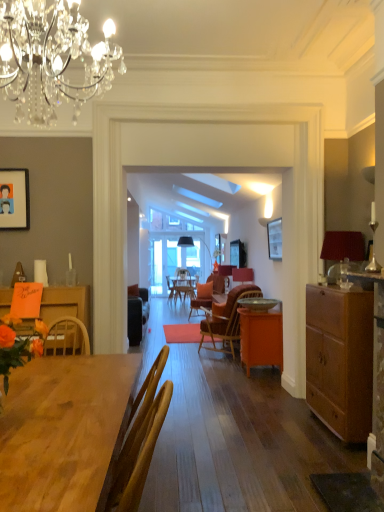
Question: Considering the relative sizes of crystal chandelier at upper center, the first lamp in the front-to-back sequence, and matte orange flowers at left in the image provided, is crystal chandelier at upper center, the first lamp in the front-to-back sequence, smaller than matte orange flowers at left?

Choices:
 (A) no
 (B) yes

Answer: (A)

Question: Is crystal chandelier at upper center, which is the 1th lamp from top to bottom, directly adjacent to matte orange flowers at left?

Choices:
 (A) no
 (B) yes

Answer: (A)

Question: Would you say crystal chandelier at upper center, the second lamp viewed from the back, is outside matte orange flowers at left?

Choices:
 (A) no
 (B) yes

Answer: (B)

Question: Can you confirm if crystal chandelier at upper center, positioned as the second lamp in bottom-to-top order, is wider than matte orange flowers at left?

Choices:
 (A) yes
 (B) no

Answer: (A)

Question: Can you confirm if crystal chandelier at upper center, the second lamp viewed from the back, is positioned to the right of matte orange flowers at left?

Choices:
 (A) no
 (B) yes

Answer: (B)

Question: Is crystal chandelier at upper center, which is the 1th lamp from top to bottom, oriented away from matte orange flowers at left?

Choices:
 (A) no
 (B) yes

Answer: (A)

Question: Is wooden chair at center to the left of matte orange flowers at left from the viewer's perspective?

Choices:
 (A) yes
 (B) no

Answer: (B)

Question: Does wooden chair at center have a greater width compared to matte orange flowers at left?

Choices:
 (A) yes
 (B) no

Answer: (A)

Question: Is wooden chair at center not within matte orange flowers at left?

Choices:
 (A) no
 (B) yes

Answer: (B)

Question: From the image's perspective, is wooden chair at center above matte orange flowers at left?

Choices:
 (A) no
 (B) yes

Answer: (A)

Question: Is wooden chair at center smaller than matte orange flowers at left?

Choices:
 (A) yes
 (B) no

Answer: (B)

Question: Is wooden chair at center taller than matte orange flowers at left?

Choices:
 (A) no
 (B) yes

Answer: (B)

Question: Is orange matte cabinet at center thinner than wooden chair at center?

Choices:
 (A) yes
 (B) no

Answer: (A)